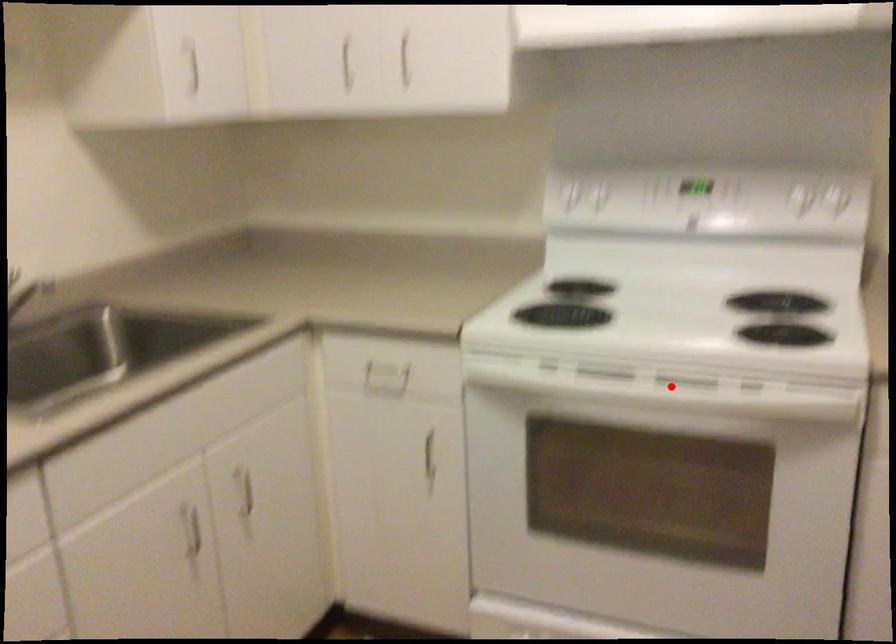
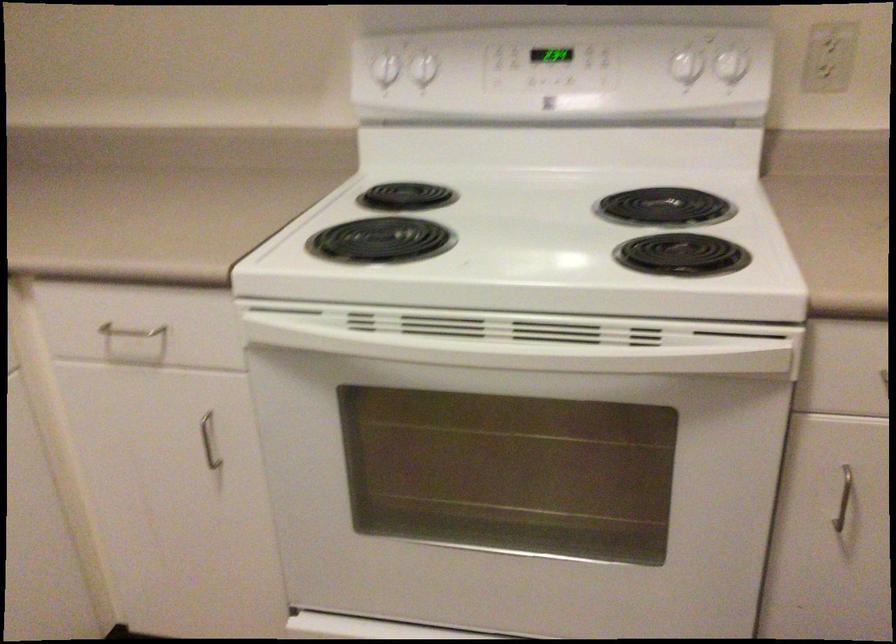
Locate, in the second image, the point that corresponds to the highlighted location in the first image.

(526, 339)